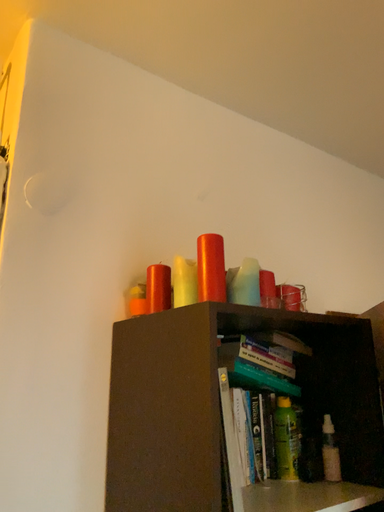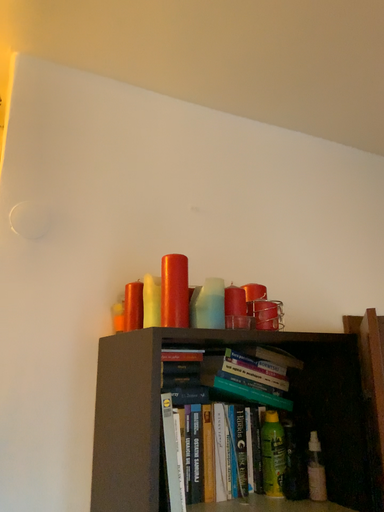
Question: How did the camera likely rotate when shooting the video?

Choices:
 (A) rotated right
 (B) rotated left

Answer: (B)